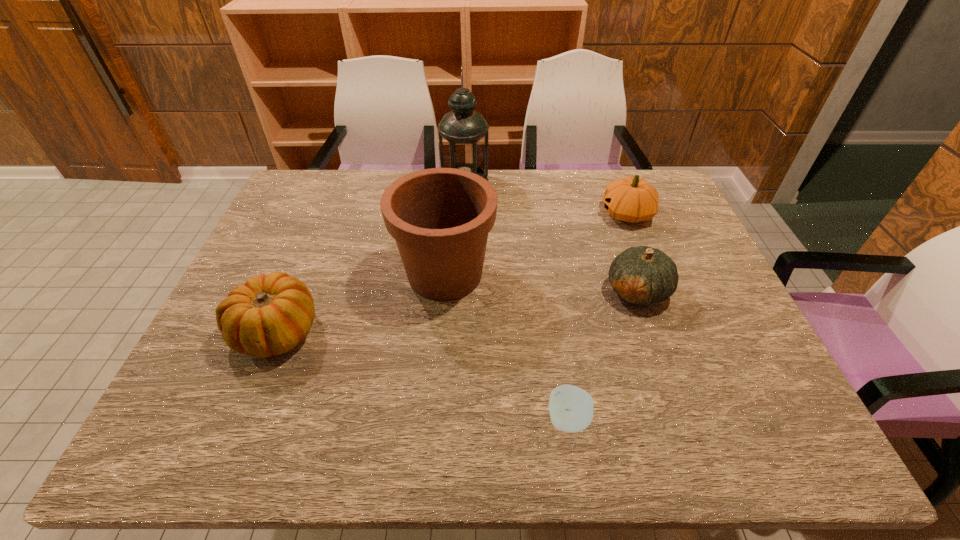
Find the location of a particular element. The width and height of the screenshot is (960, 540). gourd that is the closest one to the oil lamp is located at coordinates (632, 199).

You are a GUI agent. You are given a task and a screenshot of the screen. Output one action in this format:
    pyautogui.click(x=<x>, y=<y>)
    Task: Click on the gourd that can be found as the third closest to the flowerpot
    The image size is (960, 540).
    Given the screenshot: What is the action you would take?
    pyautogui.click(x=632, y=199)

This screenshot has height=540, width=960. What are the coordinates of `free space that satisfies the following two spatial constraints: 1. on the back side of the farthest object; 2. on the right side of the flowerpot` in the screenshot? It's located at (452, 182).

The width and height of the screenshot is (960, 540). I want to click on free space that satisfies the following two spatial constraints: 1. on the front side of the shortest object; 2. on the right side of the oil lamp, so click(x=454, y=420).

Locate an element on the screen. vacant region that satisfies the following two spatial constraints: 1. on the back side of the leftmost object; 2. on the right side of the flowerpot is located at coordinates (300, 274).